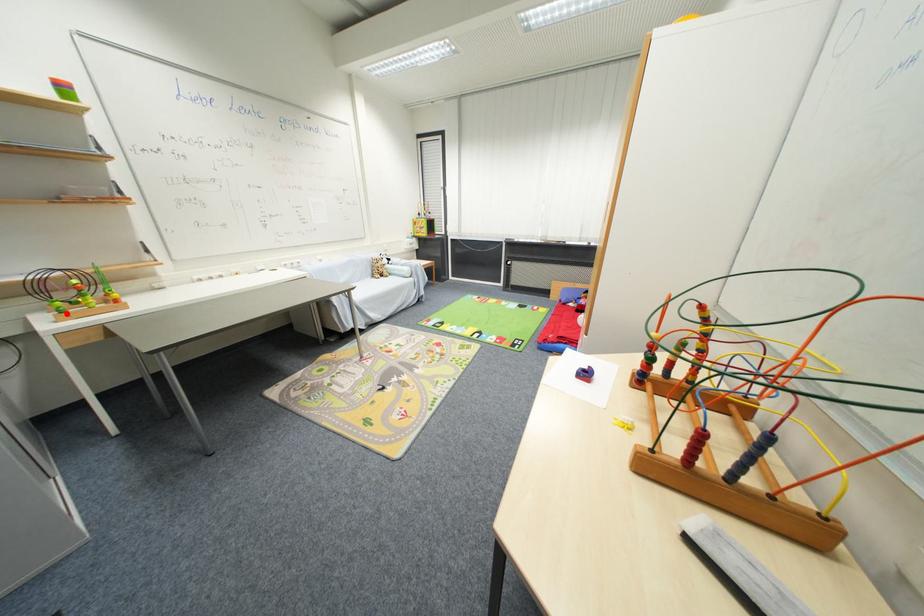
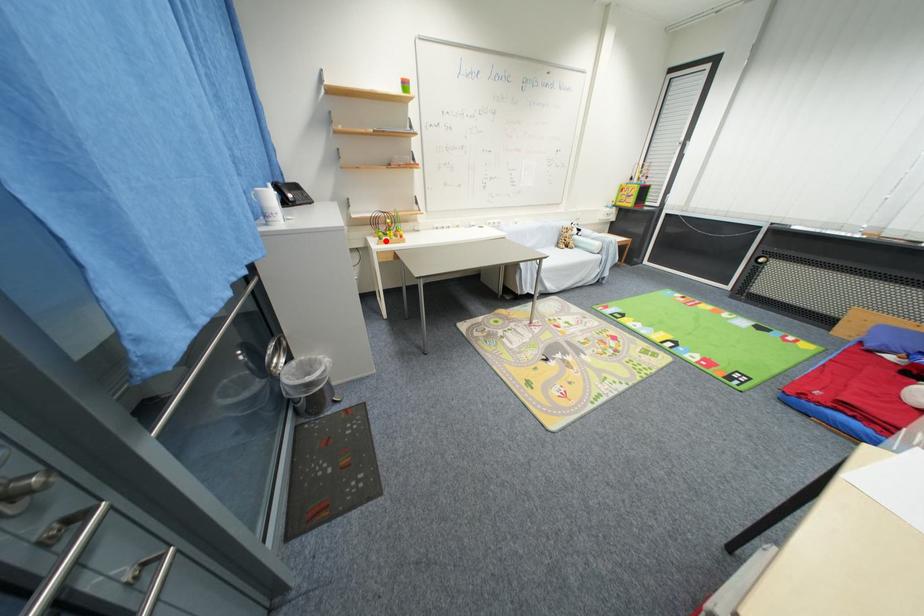
I am providing you with two images of the same scene from different viewpoints. A red point is marked on the first image and another point is marked on the second image. Is the red point in image1 aligned with the point shown in image2?

Yes